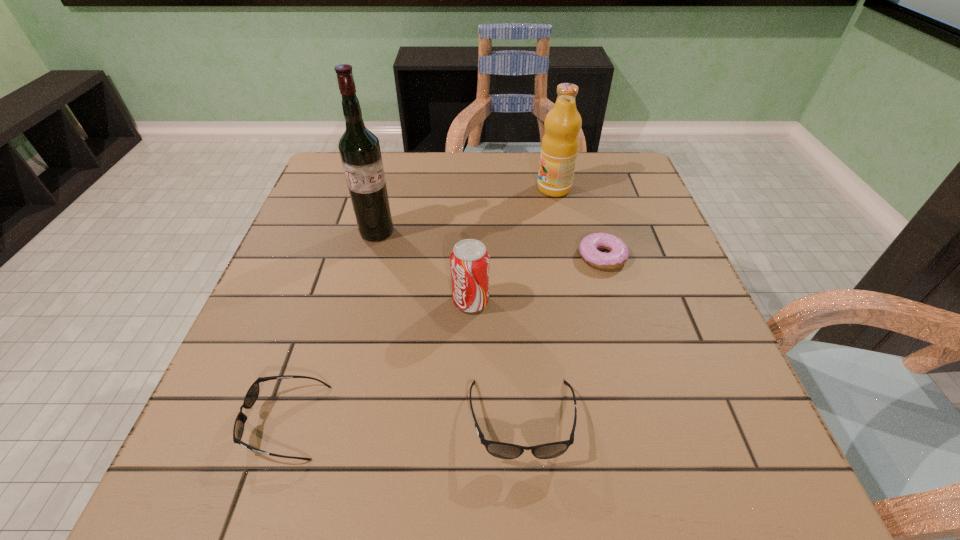
This screenshot has width=960, height=540. I want to click on free spot that satisfies the following two spatial constraints: 1. on the back side of the doughnut; 2. on the front label of the fifth shortest object, so tap(583, 188).